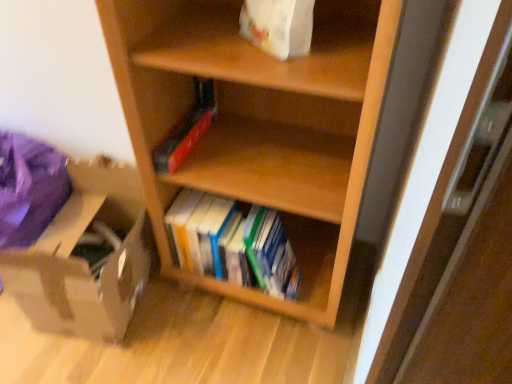
Question: From a real-world perspective, is brown cardboard box at lower left on top of wooden shelf at center?

Choices:
 (A) yes
 (B) no

Answer: (B)

Question: Could wooden shelf at center be considered to be inside brown cardboard box at lower left?

Choices:
 (A) yes
 (B) no

Answer: (B)

Question: Considering the relative sizes of brown cardboard box at lower left and wooden shelf at center in the image provided, is brown cardboard box at lower left smaller than wooden shelf at center?

Choices:
 (A) yes
 (B) no

Answer: (A)

Question: Is the surface of brown cardboard box at lower left in direct contact with wooden shelf at center?

Choices:
 (A) yes
 (B) no

Answer: (B)

Question: Considering the relative sizes of brown cardboard box at lower left and wooden shelf at center in the image provided, is brown cardboard box at lower left taller than wooden shelf at center?

Choices:
 (A) no
 (B) yes

Answer: (A)

Question: From the image's perspective, would you say brown cardboard box at lower left is shown under wooden shelf at center?

Choices:
 (A) yes
 (B) no

Answer: (A)

Question: Is white paper bag at upper center not within hardcover books at center?

Choices:
 (A) no
 (B) yes

Answer: (B)

Question: Can you confirm if white paper bag at upper center is wider than hardcover books at center?

Choices:
 (A) yes
 (B) no

Answer: (B)

Question: Considering the relative positions of white paper bag at upper center and hardcover books at center in the image provided, is white paper bag at upper center to the right of hardcover books at center from the viewer's perspective?

Choices:
 (A) no
 (B) yes

Answer: (B)

Question: Is white paper bag at upper center facing towards hardcover books at center?

Choices:
 (A) yes
 (B) no

Answer: (B)

Question: Does white paper bag at upper center come in front of hardcover books at center?

Choices:
 (A) no
 (B) yes

Answer: (B)

Question: Would you say white paper bag at upper center contains hardcover books at center?

Choices:
 (A) yes
 (B) no

Answer: (B)

Question: Is brown cardboard box at lower left smaller than hardcover books at center?

Choices:
 (A) yes
 (B) no

Answer: (B)